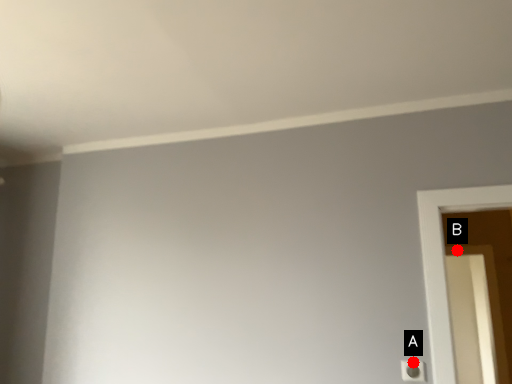
Question: Two points are circled on the image, labeled by A and B beside each circle. Which of the following is the closest to the observer?

Choices:
 (A) A is closer
 (B) B is closer

Answer: (A)